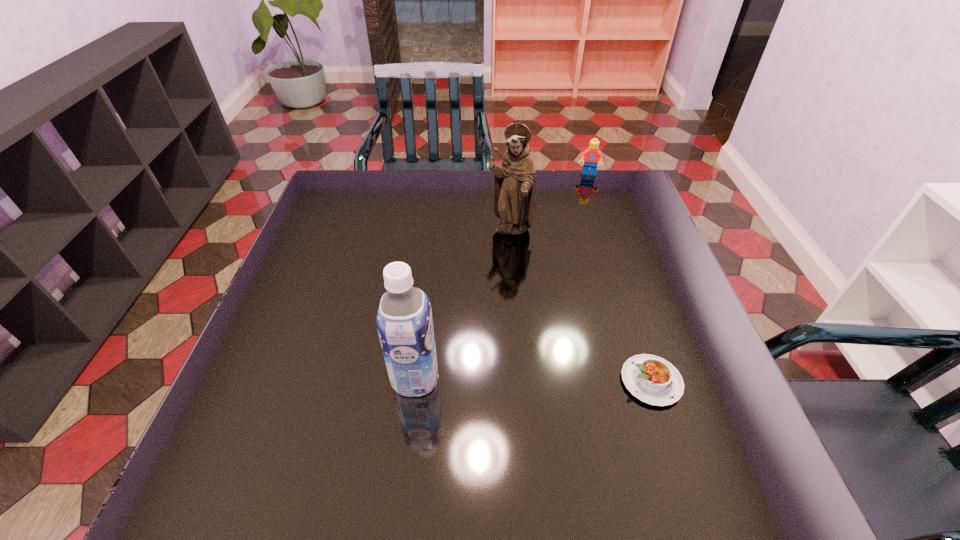
Image resolution: width=960 pixels, height=540 pixels. What are the coordinates of `soya milk` in the screenshot? It's located at (404, 320).

Where is `the shortest object`? Image resolution: width=960 pixels, height=540 pixels. the shortest object is located at coordinates click(x=653, y=380).

At what (x,y) coordinates should I click in order to perform the action: click on the third nearest object. Please return your answer as a coordinate pair (x, y). The width and height of the screenshot is (960, 540). Looking at the image, I should click on (514, 196).

At what (x,y) coordinates should I click in order to perform the action: click on figurine. Please return your answer as a coordinate pair (x, y). This screenshot has width=960, height=540. Looking at the image, I should click on (514, 196).

The image size is (960, 540). I want to click on the farthest object, so [x=591, y=156].

Identify the location of the third tallest object. (591, 156).

Find the location of `free space located 0.110m on the label of the soya milk`. free space located 0.110m on the label of the soya milk is located at coordinates (339, 379).

This screenshot has width=960, height=540. Identify the location of vacant space located 0.230m on the label of the soya milk. (279, 379).

Where is `free spot located on the label of the soya milk`? free spot located on the label of the soya milk is located at coordinates (334, 379).

In order to click on free space located 0.140m on the left of the shortest object in this screenshot , I will do `click(551, 381)`.